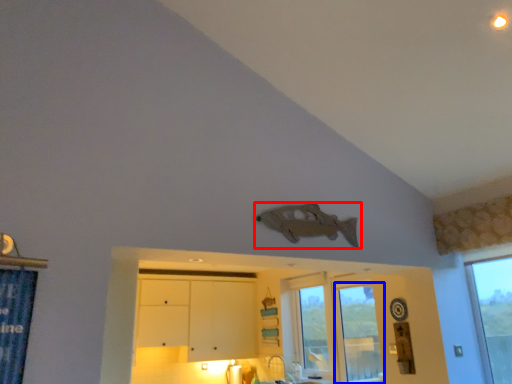
Question: Which point is further to the camera, fish (highlighted by a red box) or window (highlighted by a blue box)?

Choices:
 (A) fish
 (B) window

Answer: (B)